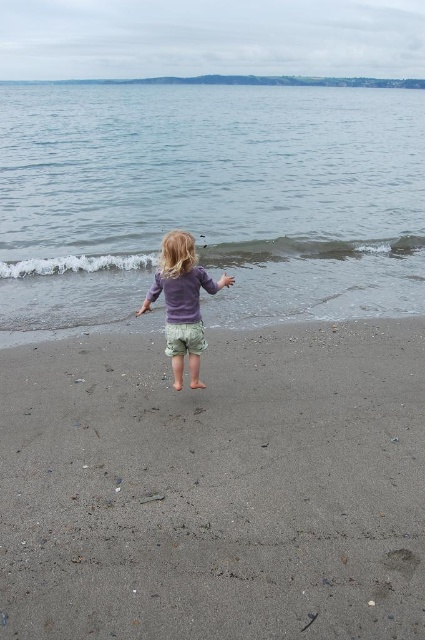
Does sandy at center appear under blue water at center?

Yes, sandy at center is below blue water at center.

Can you confirm if sandy at center is taller than blue water at center?

No, sandy at center is not taller than blue water at center.

What do you see at coordinates (215, 486) in the screenshot? This screenshot has height=640, width=425. I see `sandy at center` at bounding box center [215, 486].

The width and height of the screenshot is (425, 640). What are the coordinates of `sandy at center` in the screenshot? It's located at (215, 486).

This screenshot has height=640, width=425. What do you see at coordinates (215, 486) in the screenshot?
I see `sandy at center` at bounding box center [215, 486].

How far apart are sandy at center and purple cotton shirt at center?

The distance of sandy at center from purple cotton shirt at center is 1.27 meters.

Between point (113, 502) and point (200, 333), which one is positioned behind?

The point (200, 333) is behind.

Locate an element on the screen. sandy at center is located at coordinates (215, 486).

Does blue water at center have a larger size compared to purple cotton shirt at center?

Yes.

Consider the image. Between blue water at center and purple cotton shirt at center, which one appears on the right side from the viewer's perspective?

Positioned to the right is purple cotton shirt at center.

Which is behind, point (342, 230) or point (155, 294)?

The point (342, 230) is behind.

The height and width of the screenshot is (640, 425). Identify the location of blue water at center. (210, 198).